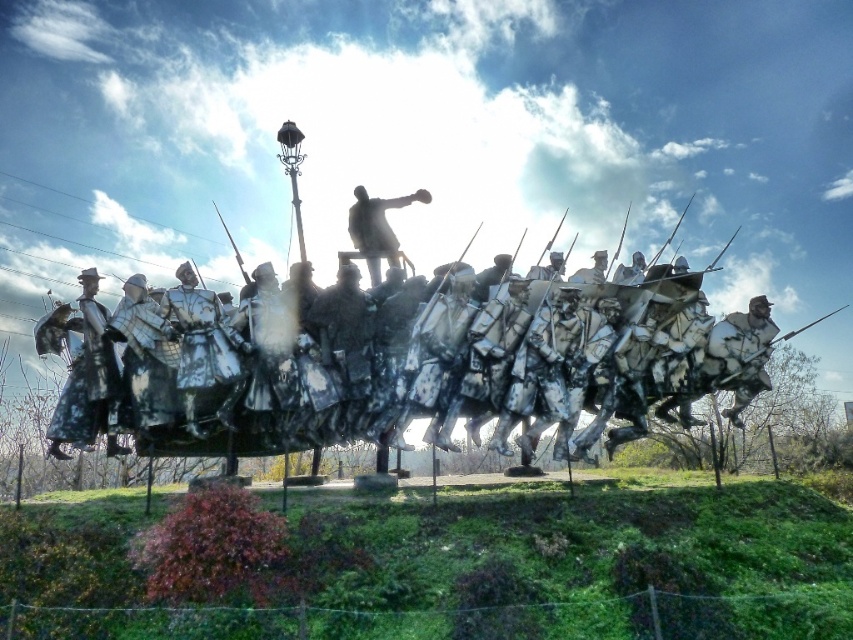
Measure the distance from metallic silver soldiers at center to shiny silver armor at left.

A distance of 34.69 feet exists between metallic silver soldiers at center and shiny silver armor at left.

Between metallic silver soldiers at center and shiny silver armor at left, which one is positioned higher?

Positioned higher is metallic silver soldiers at center.

Is point (160, 365) more distant than point (96, 355)?

No, (160, 365) is closer to viewer.

This screenshot has height=640, width=853. In order to click on metallic silver soldiers at center in this screenshot , I will do `click(422, 360)`.

Does metallic silver soldiers at center appear on the right side of bronze statue at center?

Indeed, metallic silver soldiers at center is positioned on the right side of bronze statue at center.

How distant is metallic silver soldiers at center from bronze statue at center?

metallic silver soldiers at center is 11.20 meters from bronze statue at center.

Is point (260, 394) less distant than point (380, 248)?

Yes, point (260, 394) is in front of point (380, 248).

What are the coordinates of `metallic silver soldiers at center` in the screenshot? It's located at (422, 360).

Who is shorter, shiny silver armor at left or bronze statue at center?

Standing shorter between the two is bronze statue at center.

Is point (125, 445) more distant than point (363, 256)?

No, it is in front of (363, 256).

This screenshot has height=640, width=853. Identify the location of shiny silver armor at left. (86, 380).